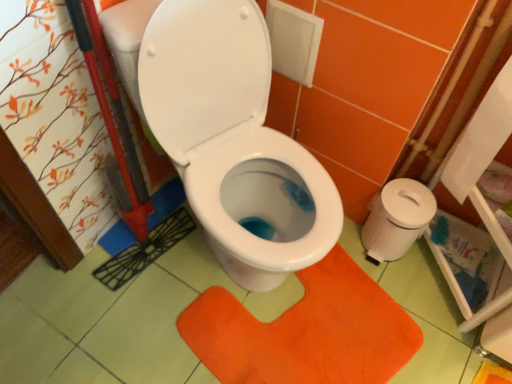
Question: Would you say white plastic toilet paper at right, which is the 2th toilet paper from front to back, is to the left or to the right of orange textured mat at center in the picture?

Choices:
 (A) right
 (B) left

Answer: (A)

Question: Is white plastic toilet paper at right, which is the 2th toilet paper from front to back, taller or shorter than orange textured mat at center?

Choices:
 (A) short
 (B) tall

Answer: (B)

Question: Estimate the real-world distances between objects in this image. Which object is closer to the white plastic toilet paper at right, which is the 2th toilet paper from front to back?

Choices:
 (A) orange textured mat at center
 (B) white paper at right, which is the second toilet paper from back to front

Answer: (B)

Question: Considering the real-world distances, which object is farthest from the orange textured mat at center?

Choices:
 (A) white paper at right, acting as the 1th toilet paper starting from the front
 (B) white plastic toilet paper at right, which is the 2th toilet paper from front to back

Answer: (A)